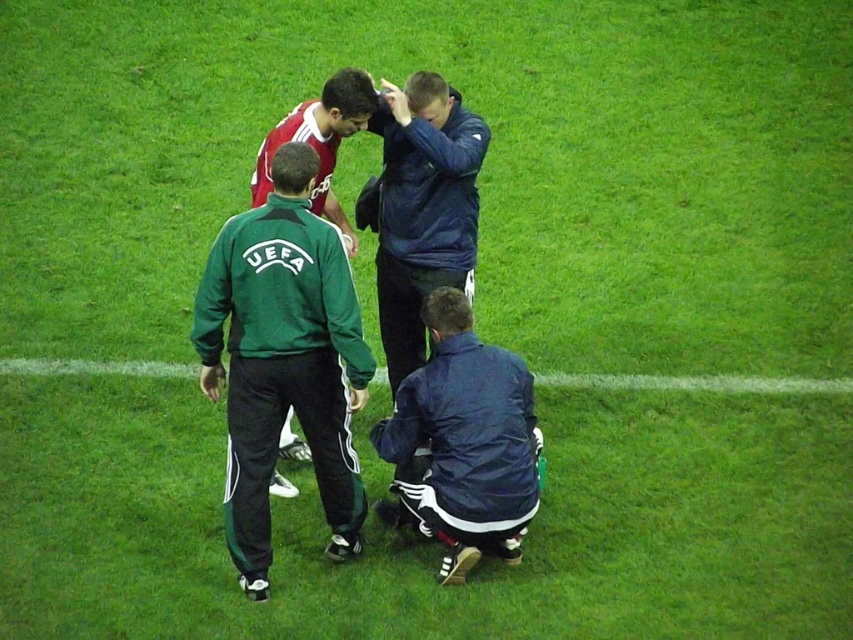
Question: In this image, where is dark blue fabric jacket at lower center located relative to green synthetic turf at lower center?

Choices:
 (A) left
 (B) right

Answer: (A)

Question: Among these objects, which one is farthest from the camera?

Choices:
 (A) green synthetic turf at lower center
 (B) dark blue fabric jacket at lower center
 (C) red jersey at upper center
 (D) dark blue jacket at center

Answer: (A)

Question: Which of the following is the farthest from the observer?

Choices:
 (A) green synthetic turf at lower center
 (B) red jersey at upper center

Answer: (A)

Question: Can you confirm if dark blue jacket at center is positioned to the right of red jersey at upper center?

Choices:
 (A) yes
 (B) no

Answer: (A)

Question: Which object appears farthest from the camera in this image?

Choices:
 (A) dark blue jacket at center
 (B) dark blue fabric jacket at lower center
 (C) green synthetic turf at lower center

Answer: (C)

Question: In this image, where is dark blue fabric jacket at lower center located relative to red jersey at upper center?

Choices:
 (A) left
 (B) right

Answer: (B)